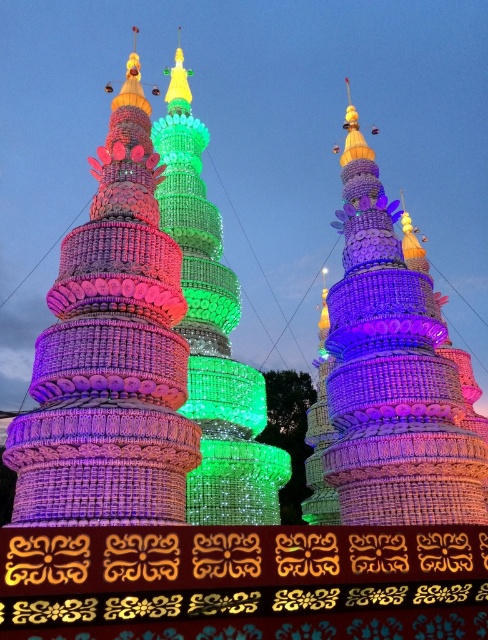
Does matte purple tower at left have a lesser width compared to multicolored glass beads at center?

Incorrect, matte purple tower at left's width is not less than multicolored glass beads at center's.

Between matte purple tower at left and multicolored glass beads at center, which one has less height?

multicolored glass beads at center

Where is `matte purple tower at left`? This screenshot has width=488, height=640. matte purple tower at left is located at coordinates (110, 355).

Locate an element on the screen. This screenshot has height=640, width=488. matte purple tower at left is located at coordinates (110, 355).

This screenshot has width=488, height=640. Describe the element at coordinates (110, 355) in the screenshot. I see `matte purple tower at left` at that location.

The height and width of the screenshot is (640, 488). What are the coordinates of `matte purple tower at left` in the screenshot? It's located at (x=110, y=355).

Locate an element on the screen. matte purple tower at left is located at coordinates (110, 355).

Between point (393, 356) and point (195, 284), which one is positioned behind?

The point (195, 284) is behind.

Can you confirm if multicolored glass beads at center is positioned above green glass tower at center?

No.

Is point (345, 440) positioned in front of point (175, 52)?

Yes, it is.

What are the coordinates of `multicolored glass beads at center` in the screenshot? It's located at (391, 371).